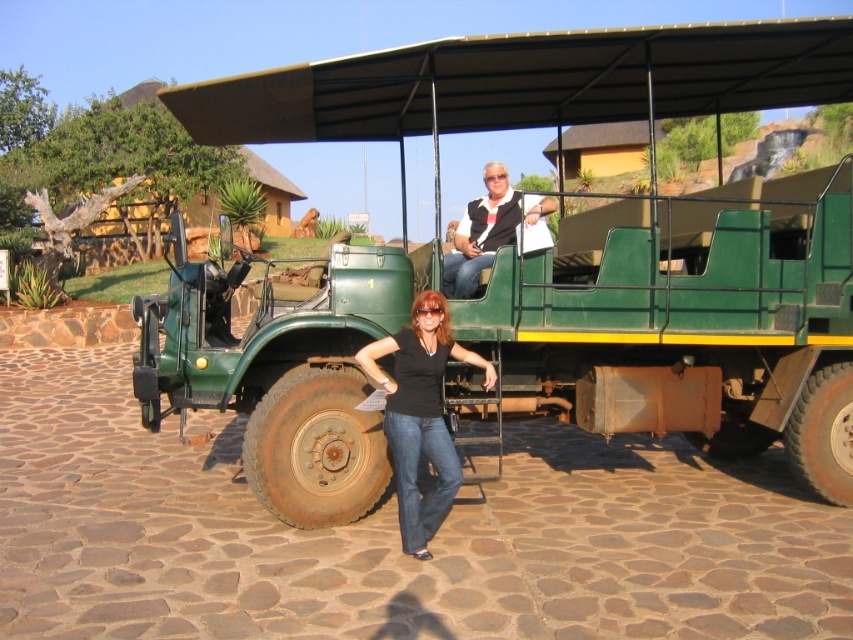
Question: Can you confirm if rusty metal tire at lower left is positioned above matte black vest at upper center?

Choices:
 (A) yes
 (B) no

Answer: (B)

Question: Where is rusty metal tire at lower left located in relation to brown rubber tire at lower right in the image?

Choices:
 (A) right
 (B) left

Answer: (B)

Question: Which of the following is the closest to the observer?

Choices:
 (A) (517, 220)
 (B) (723, 404)
 (C) (415, 323)

Answer: (C)

Question: Is rusty metal tire at lower left bigger than black matte shirt at center?

Choices:
 (A) no
 (B) yes

Answer: (A)

Question: Which object is closer to the camera taking this photo?

Choices:
 (A) brown rubber tire at lower right
 (B) black matte shirt at center
 (C) matte black vest at upper center
 (D) rusty metal tire at lower right

Answer: (B)

Question: Which point is farther to the camera?

Choices:
 (A) rusty metal tire at lower left
 (B) matte black vest at upper center
 (C) brown rubber tire at lower right
 (D) black matte shirt at center

Answer: (C)